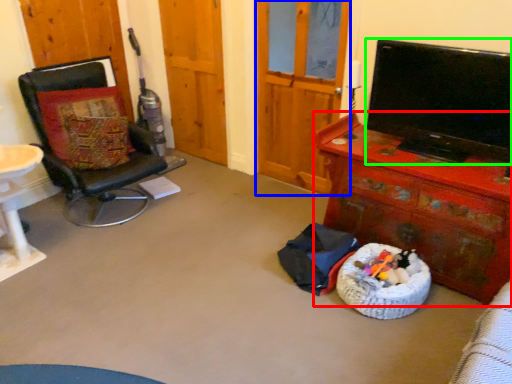
Question: Which object is the farthest from desk (highlighted by a red box)? Choose among these: screen door (highlighted by a blue box) or television (highlighted by a green box).

Choices:
 (A) screen door
 (B) television

Answer: (A)